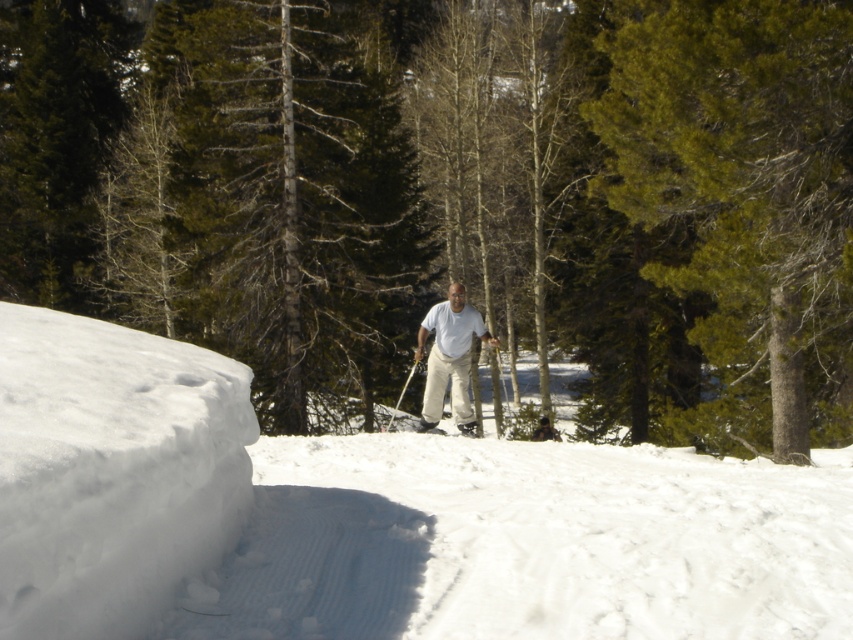
Can you confirm if green textured pine tree at center is shorter than light beige pants at center?

No, green textured pine tree at center is not shorter than light beige pants at center.

Which is above, green textured pine tree at center or light beige pants at center?

green textured pine tree at center is above.

Is point (785, 349) farther from viewer compared to point (450, 312)?

Yes, it is.

The width and height of the screenshot is (853, 640). Find the location of `green textured pine tree at center`. green textured pine tree at center is located at coordinates (453, 195).

Does white fluffy snow at center appear under green needle-like at center?

Yes, white fluffy snow at center is below green needle-like at center.

Is white fluffy snow at center wider than green needle-like at center?

Correct, the width of white fluffy snow at center exceeds that of green needle-like at center.

Describe the element at coordinates (376, 515) in the screenshot. I see `white fluffy snow at center` at that location.

The image size is (853, 640). I want to click on white fluffy snow at center, so click(x=376, y=515).

Consider the image. Who is more distant from viewer, [509,168] or [393,416]?

The point [509,168] is behind.

At what (x,y) coordinates should I click in order to perform the action: click on green textured pine tree at center. Please return your answer as a coordinate pair (x, y). This screenshot has width=853, height=640. Looking at the image, I should click on (453, 195).